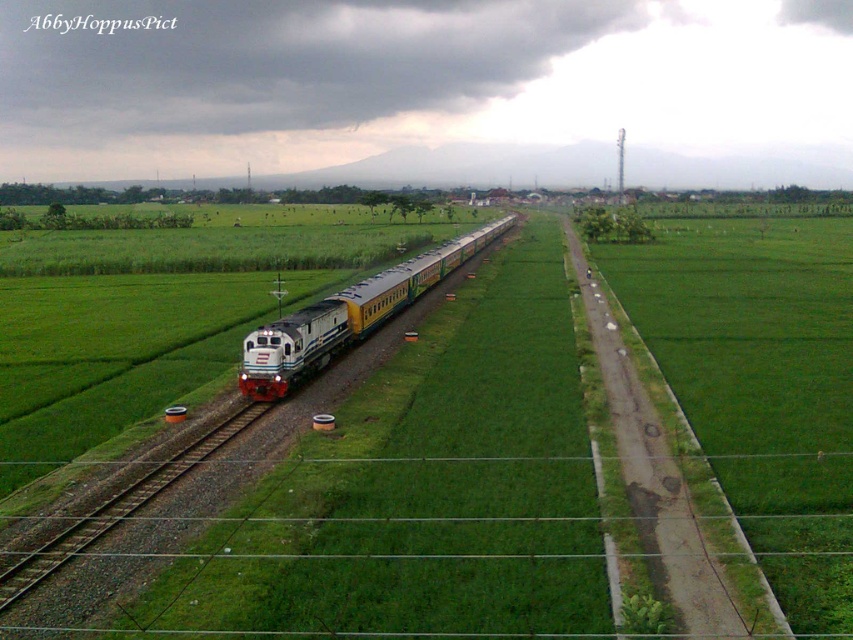
Question: Which point appears closest to the camera in this image?

Choices:
 (A) (328, 307)
 (B) (120, 512)
 (C) (550, 301)

Answer: (B)

Question: Among these objects, which one is farthest from the camera?

Choices:
 (A) yellow-green painted passenger train at center
 (B) green grass field at center

Answer: (A)

Question: Can you confirm if green grass field at center is smaller than smooth metal train track at center?

Choices:
 (A) yes
 (B) no

Answer: (B)

Question: Is green grass field at center wider than smooth metal train track at center?

Choices:
 (A) no
 (B) yes

Answer: (B)

Question: Is yellow-green painted passenger train at center positioned at the back of smooth metal train track at center?

Choices:
 (A) no
 (B) yes

Answer: (B)

Question: Which object appears closest to the camera in this image?

Choices:
 (A) yellow-green painted passenger train at center
 (B) green grass field at center
 (C) smooth metal train track at center

Answer: (B)